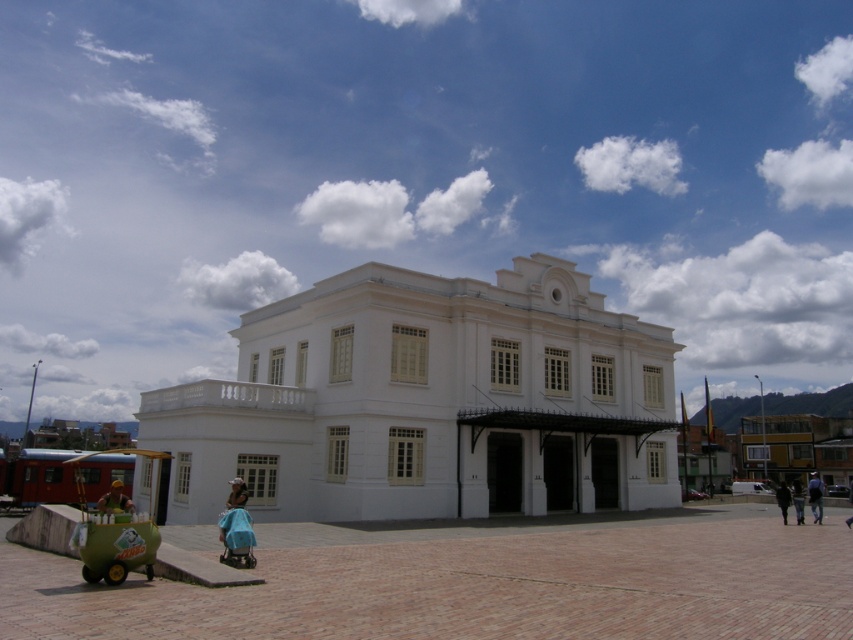
You are standing at the entrance of the building and want to reach the point marked as point (814, 522). The plaza in front of the building is 40 meters long. Can you walk straight from the entrance to reach that point without crossing the plaza boundary?

The distance between you and point (814, 522) is 39.61 meters, and the plaza is 40 meters long. Since the distance to the point is slightly less than the plaza length, you can walk straight to reach the point without crossing the plaza boundary.

You are a photographer setting up for an event. You have a blue satin dress at lower center and a dark blue fabric at lower right. Which object should you place closer to the camera to ensure it appears larger in the photo?

The dark blue fabric at lower right should be placed closer to the camera because it is shorter than the blue satin dress at lower center, so moving it closer would make it appear larger in the photo.